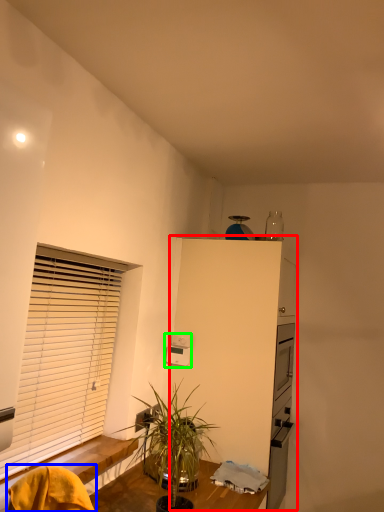
Question: Which object is the farthest from dresser (highlighted by a red box)? Choose among these: swivel chair (highlighted by a blue box) or appliance (highlighted by a green box).

Choices:
 (A) swivel chair
 (B) appliance

Answer: (A)